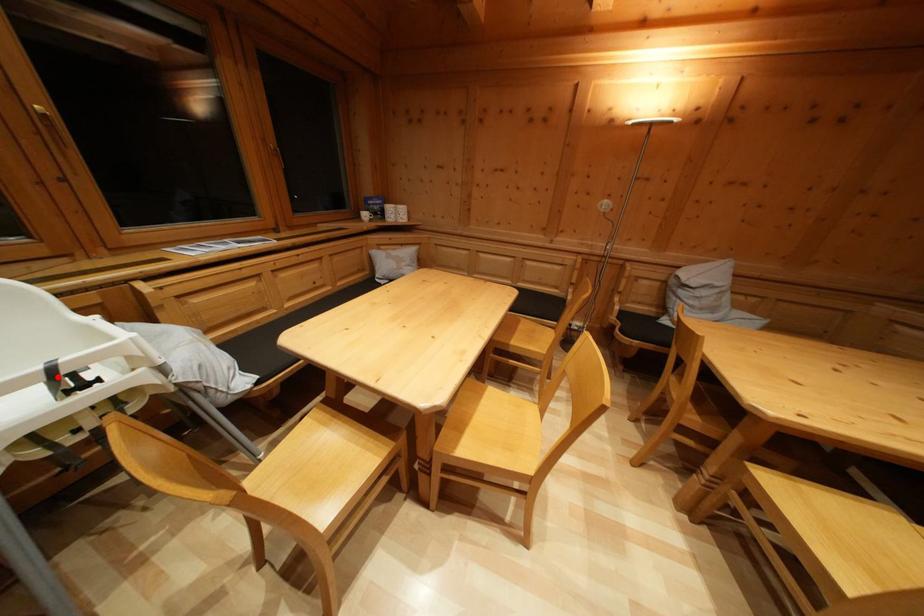
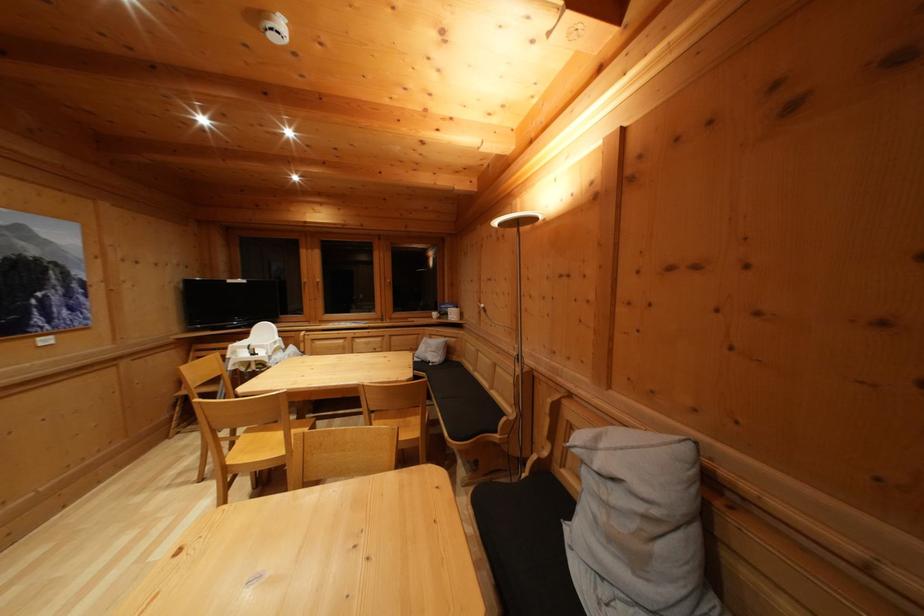
Where in the second image is the point corresponding to the highlighted location from the first image?

(254, 353)